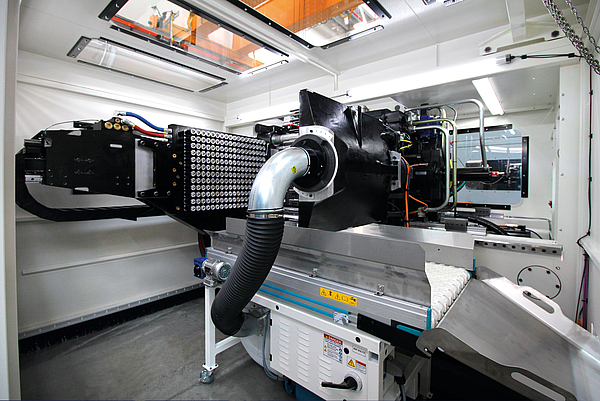
The height and width of the screenshot is (401, 600). In order to click on white walls in this screenshot , I will do (x=52, y=282), (x=54, y=109), (x=435, y=60), (x=535, y=128).